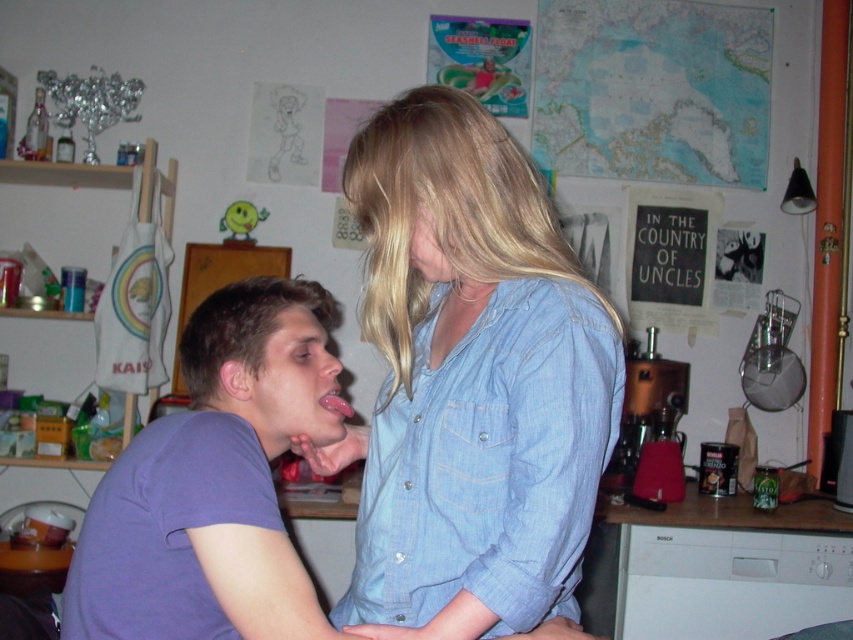
Question: Does blue denim shirt at center appear on the left side of purple cotton t-shirt at left?

Choices:
 (A) yes
 (B) no

Answer: (B)

Question: Which point is farther to the camera?

Choices:
 (A) purple cotton t-shirt at left
 (B) blue denim shirt at center

Answer: (A)

Question: Can you confirm if blue denim shirt at center is positioned to the left of purple cotton t-shirt at left?

Choices:
 (A) yes
 (B) no

Answer: (B)

Question: Which of the following is the closest to the observer?

Choices:
 (A) (486, 588)
 (B) (241, 468)

Answer: (A)

Question: Considering the relative positions of blue denim shirt at center and purple cotton t-shirt at left in the image provided, where is blue denim shirt at center located with respect to purple cotton t-shirt at left?

Choices:
 (A) below
 (B) above

Answer: (B)